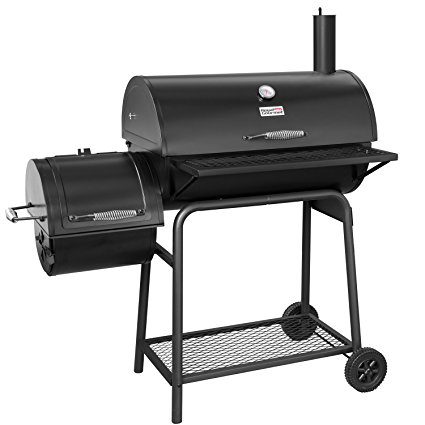
Find the location of a particular element. handle is located at coordinates (12, 215).